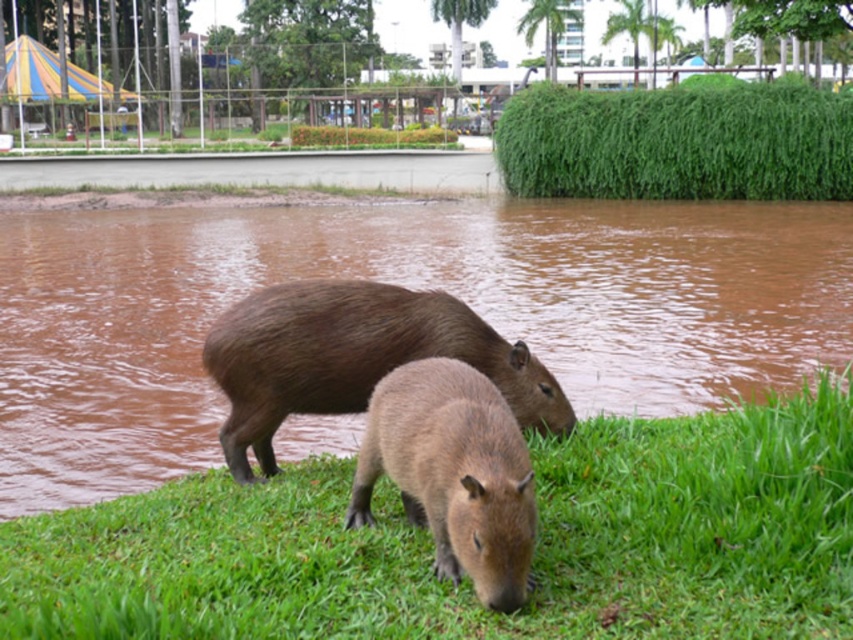
You are a wildlife photographer aiming to capture both capybaras in a single shot. Since you want to focus on the one closer to you, which capybara should you adjust your camera settings for, the brown fur capybara at lower center or the brown furry capybara at lower center?

The brown fur capybara at lower center is closer to you, so adjust your camera settings for it to ensure it is in focus while the other remains visible in the background.

You are standing at the point marked by the coordinates point (405, 284) in the image. Which capybara are you closest to?

You are closest to the brown fur capybara at lower center because the point (405, 284) indicates its location.

You are a drone operator tasked with capturing aerial footage of the green leafy grass at upper center and the brown furry capybara at center. Your drone has a maximum flight range of 30 meters. Can you fly your drone from the capybara to the grass without exceeding the range limit?

The distance between the green leafy grass at upper center and the brown furry capybara at center is 26.96 meters, which is within the drone operator s 30 meter range limit. Yes, the drone can fly from the brown furry capybara at center to the green leafy grass at upper center without exceeding the range limit.